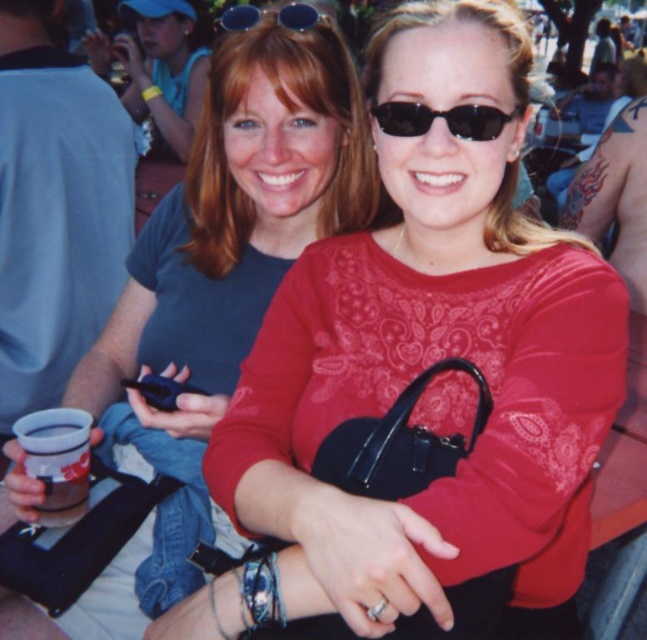
You are a photographer trying to capture a candid shot of the two friends. You notice there are two items in the scene that might distract from their faces. The matte black purse at center and the sunglasses at upper center. How far apart are these two items in inches?

The matte black purse at center is 18.01 inches from sunglasses at upper center.